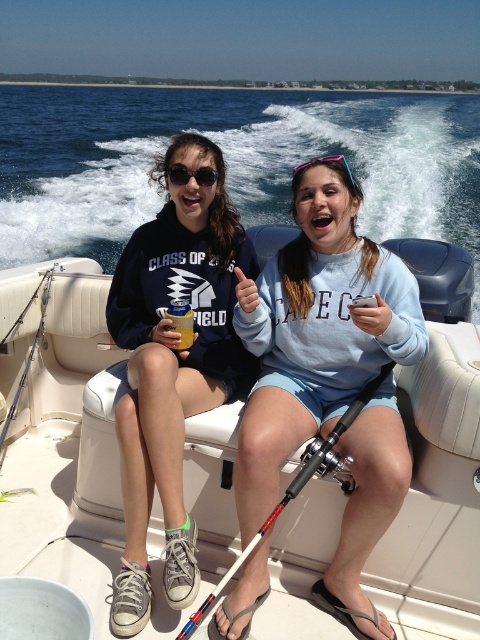
From the picture: You are a photographer taking a picture of the two points on the boat. Which point, point 1 at coordinates (213, 204) or point 2 at coordinates (337, 157), will appear closer to you in the photo?

Point 1 at coordinates (213, 204) will appear closer to you in the photo because it is further to the viewer than point 2 at coordinates (337, 157).

You are a photographer on the boat and want to take a photo of the light blue cotton sweatshirt at center and the red and black fishing pole at center. Which object is positioned to the right side in the image?

The light blue cotton sweatshirt at center is positioned to the right of the red and black fishing pole at center.